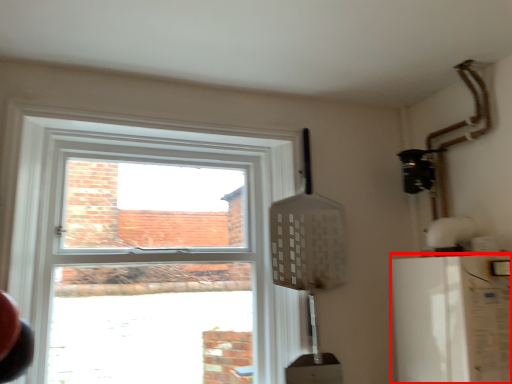
Question: In this image, where is appliance (annotated by the red box) located relative to window?

Choices:
 (A) left
 (B) right

Answer: (B)